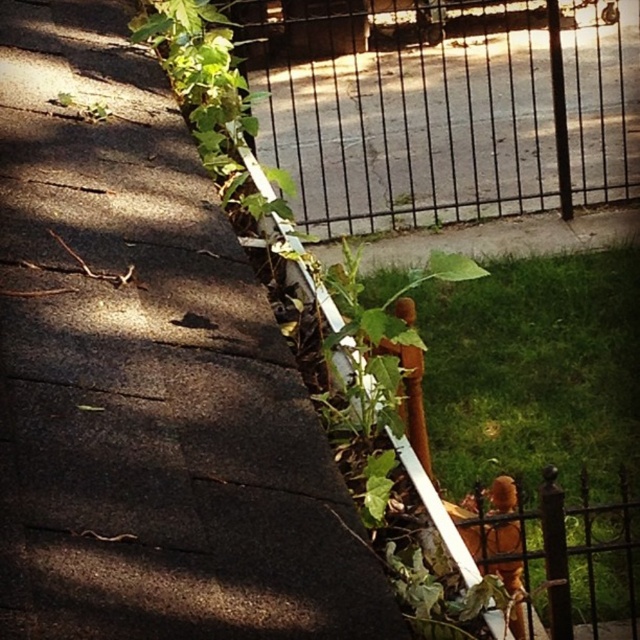
Question: Based on their relative distances, which object is farther from the green leafy plant at center?

Choices:
 (A) green leafy plant at upper center
 (B) black metal fence at upper center

Answer: (A)

Question: Which object appears farthest from the camera in this image?

Choices:
 (A) black metal fence at upper center
 (B) green leafy plant at upper center
 (C) green leafy plant at center

Answer: (A)

Question: Which object is closer to the camera taking this photo?

Choices:
 (A) green leafy plant at center
 (B) green leafy plant at upper center

Answer: (B)

Question: Observing the image, what is the correct spatial positioning of black metal fence at upper center in reference to green leafy plant at center?

Choices:
 (A) left
 (B) right

Answer: (B)

Question: Can you confirm if green leafy plant at upper center is positioned below green leafy plant at center?

Choices:
 (A) no
 (B) yes

Answer: (A)

Question: Is green leafy plant at upper center further to the viewer compared to green leafy plant at center?

Choices:
 (A) no
 (B) yes

Answer: (A)